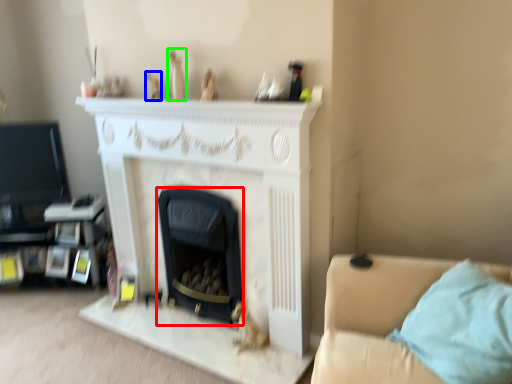
Question: Which object is the closest to the fireplace (highlighted by a red box)? Choose among these: toy (highlighted by a blue box) or toy (highlighted by a green box).

Choices:
 (A) toy
 (B) toy

Answer: (B)